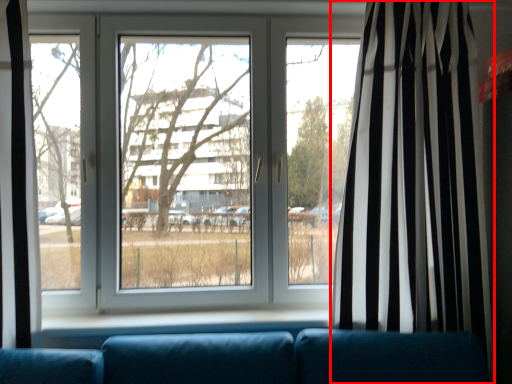
Question: From the image's perspective, what is the correct spatial positioning of curtain (annotated by the red box) in reference to window?

Choices:
 (A) above
 (B) below

Answer: (B)